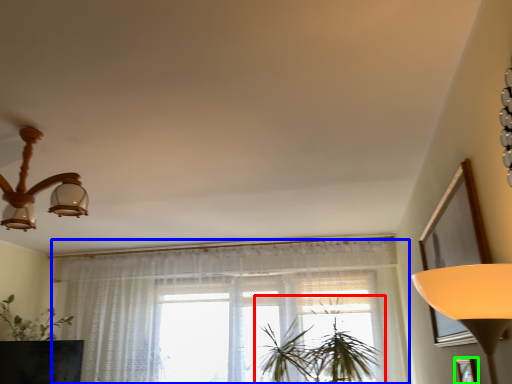
Question: Which is nearer to the houseplant (highlighted by a red box)? curtain (highlighted by a blue box) or picture frame (highlighted by a green box).

Choices:
 (A) curtain
 (B) picture frame

Answer: (A)